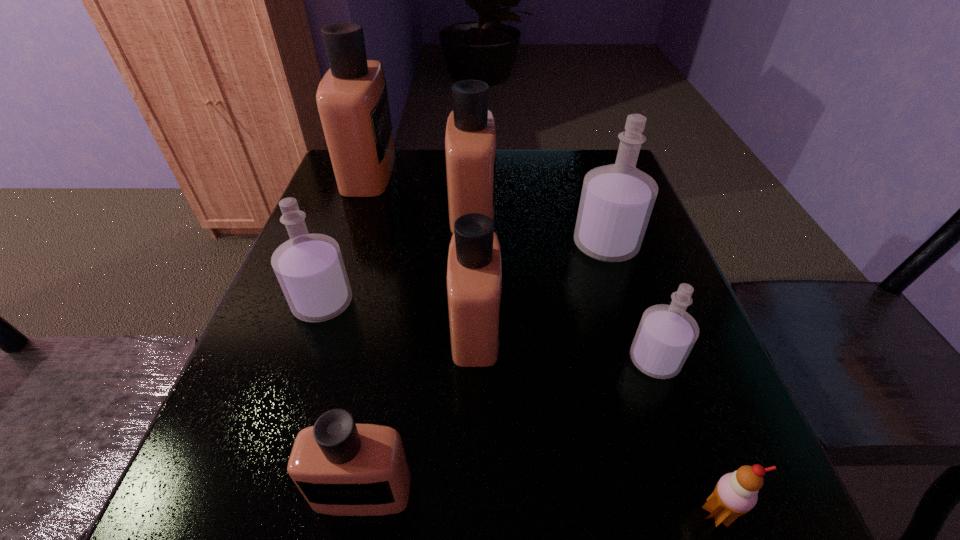
The height and width of the screenshot is (540, 960). I want to click on the biggest beige perfume, so click(352, 99).

At what (x,y) coordinates should I click in order to perform the action: click on the tallest object. Please return your answer as a coordinate pair (x, y). Looking at the image, I should click on (352, 99).

Image resolution: width=960 pixels, height=540 pixels. I want to click on the second biggest beige perfume, so click(470, 141).

You are a GUI agent. You are given a task and a screenshot of the screen. Output one action in this format:
    pyautogui.click(x=<x>, y=<y>)
    Task: Click on the biggest purple perfume
    Image resolution: width=960 pixels, height=540 pixels.
    Given the screenshot: What is the action you would take?
    pyautogui.click(x=617, y=200)

At what (x,y) coordinates should I click in order to perform the action: click on the second biggest purple perfume. Please return your answer as a coordinate pair (x, y). Image resolution: width=960 pixels, height=540 pixels. Looking at the image, I should click on (309, 267).

Where is `the second farthest purple perfume`? The height and width of the screenshot is (540, 960). the second farthest purple perfume is located at coordinates point(309,267).

Where is `the third biggest beige perfume`? This screenshot has width=960, height=540. the third biggest beige perfume is located at coordinates (474, 271).

The height and width of the screenshot is (540, 960). I want to click on the smallest purple perfume, so click(666, 334).

The image size is (960, 540). In order to click on the nearest beige perfume in this screenshot , I will do `click(341, 468)`.

At what (x,y) coordinates should I click in order to perform the action: click on the sixth object from right to left. Please return your answer as a coordinate pair (x, y). Looking at the image, I should click on (341, 468).